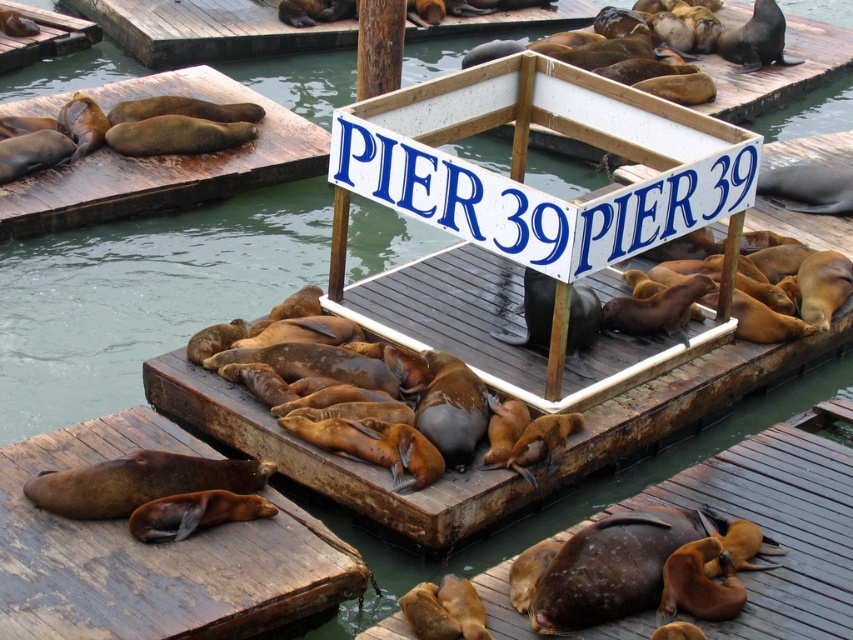
Locate an element on the screen. brown wood dock at lower left is located at coordinates (154, 554).

Is brown wood dock at lower left wider than brown wood dock at upper left?

No.

Is brown wood dock at lower left behind brown wood dock at upper left?

No, it is not.

Is point (288, 600) in front of point (44, 184)?

Yes, it is in front of point (44, 184).

The image size is (853, 640). What are the coordinates of `brown wood dock at lower left` in the screenshot? It's located at (154, 554).

Is the position of brown matte dock at lower center less distant than that of brown wood dock at upper left?

That is True.

Find the location of a particular element. Image resolution: width=853 pixels, height=640 pixels. brown matte dock at lower center is located at coordinates (778, 524).